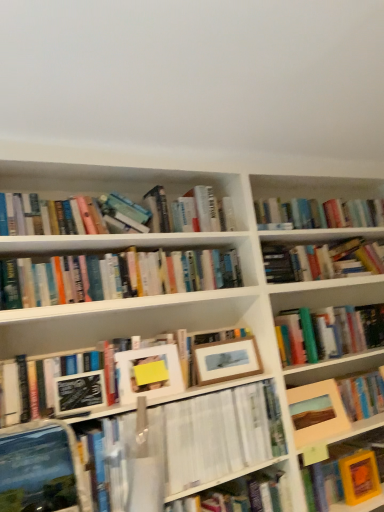
Question: From the image's perspective, is wooden picture frame at center right, the first picture frame positioned from the right, located beneath matte black paperback book at center-left, placed as the 1th paperback book when sorted from left to right?

Choices:
 (A) yes
 (B) no

Answer: (A)

Question: Is wooden picture frame at center right, the first picture frame positioned from the right, not near matte black paperback book at center-left, the 1th paperback book in the front-to-back sequence?

Choices:
 (A) yes
 (B) no

Answer: (B)

Question: Considering the relative sizes of wooden picture frame at center right, the first picture frame positioned from the right, and matte black paperback book at center-left, which appears as the first paperback book when viewed from the top, in the image provided, is wooden picture frame at center right, the first picture frame positioned from the right, smaller than matte black paperback book at center-left, which appears as the first paperback book when viewed from the top,?

Choices:
 (A) yes
 (B) no

Answer: (B)

Question: Can you confirm if wooden picture frame at center right, the first picture frame positioned from the right, is positioned to the right of matte black paperback book at center-left, the 1th paperback book in the front-to-back sequence?

Choices:
 (A) yes
 (B) no

Answer: (A)

Question: Is wooden picture frame at center right, the first picture frame positioned from the right, placed right next to matte black paperback book at center-left, which is the 2th paperback book in bottom-to-top order?

Choices:
 (A) yes
 (B) no

Answer: (B)

Question: From a real-world perspective, is orange matte book at lower right, the 2th paperback book positioned from the top, positioned above or below matte black paperback book at center-left, the 1th paperback book in the front-to-back sequence?

Choices:
 (A) below
 (B) above

Answer: (A)

Question: Considering their positions, is orange matte book at lower right, which is the 2th paperback book in front-to-back order, located in front of or behind matte black paperback book at center-left, which is the 2th paperback book in bottom-to-top order?

Choices:
 (A) behind
 (B) front

Answer: (A)

Question: Would you say orange matte book at lower right, arranged as the first paperback book when viewed from the back, is to the left or to the right of matte black paperback book at center-left, the 1th paperback book in the front-to-back sequence, in the picture?

Choices:
 (A) left
 (B) right

Answer: (B)

Question: Considering the positions of orange matte book at lower right, the 2th paperback book positioned from the top, and matte black paperback book at center-left, which is the 2th paperback book in right-to-left order, in the image, is orange matte book at lower right, the 2th paperback book positioned from the top, wider or thinner than matte black paperback book at center-left, which is the 2th paperback book in right-to-left order,?

Choices:
 (A) thin
 (B) wide

Answer: (B)

Question: Would you say wooden picture frame at center, acting as the second picture frame starting from the left, is inside or outside hardcover book at center, which is the 1th book in top-to-bottom order?

Choices:
 (A) outside
 (B) inside

Answer: (A)

Question: From the image's perspective, is wooden picture frame at center, which is the 2th picture frame from right to left, above or below hardcover book at center, which is the 1th book in top-to-bottom order?

Choices:
 (A) above
 (B) below

Answer: (B)

Question: From a real-world perspective, is wooden picture frame at center, which is the 2th picture frame from right to left, physically located above or below hardcover book at center, which is the 1th book in top-to-bottom order?

Choices:
 (A) above
 (B) below

Answer: (B)

Question: Considering the positions of point (210, 382) and point (213, 210), is point (210, 382) closer or farther from the camera than point (213, 210)?

Choices:
 (A) farther
 (B) closer

Answer: (B)

Question: In the image, is matte black paperback book at center-left, placed as the 1th paperback book when sorted from left to right, positioned in front of or behind hardcover book at center, which appears as the 2th book when ordered from the bottom?

Choices:
 (A) front
 (B) behind

Answer: (A)

Question: From the image's perspective, is matte black paperback book at center-left, which is the 2th paperback book in right-to-left order, above or below hardcover book at center, which is the 1th book in top-to-bottom order?

Choices:
 (A) above
 (B) below

Answer: (B)